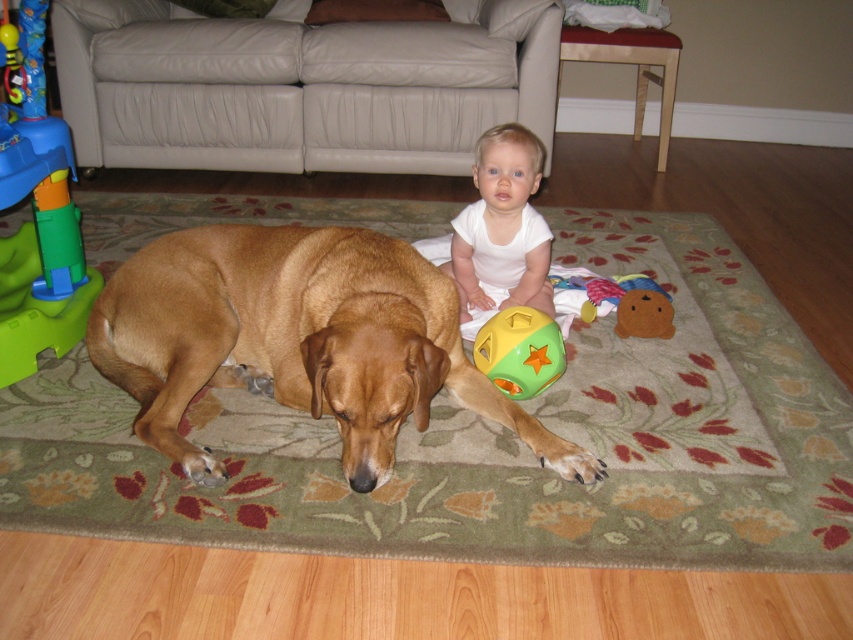
Question: Which point is farther to the camera?

Choices:
 (A) floral rug at center
 (B) beige leather couch at upper center
 (C) brown furry dog at center

Answer: (B)

Question: Is green rubber ball at center above soft plush bear at center?

Choices:
 (A) yes
 (B) no

Answer: (B)

Question: Is green plastic toy at left to the left of soft plush bear at center from the viewer's perspective?

Choices:
 (A) yes
 (B) no

Answer: (A)

Question: Which of the following is the farthest from the observer?

Choices:
 (A) (254, 388)
 (B) (537, 346)
 (C) (74, 413)
 (D) (45, 324)

Answer: (D)

Question: Considering the real-world distances, which object is closest to the floral rug at center?

Choices:
 (A) beige leather couch at upper center
 (B) brown furry dog at center

Answer: (B)

Question: Can you confirm if brown furry dog at center is positioned above green rubber ball at center?

Choices:
 (A) no
 (B) yes

Answer: (A)